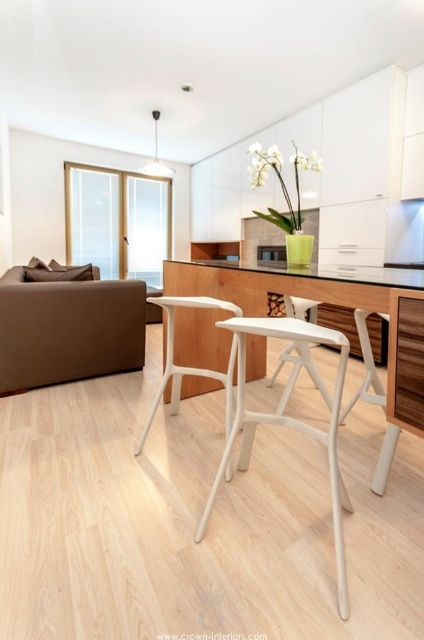
Question: Is white plastic table at center below white plastic bar stool at center?

Choices:
 (A) no
 (B) yes

Answer: (A)

Question: Does brown leather couch at left have a lesser width compared to white plastic bar stool at center?

Choices:
 (A) yes
 (B) no

Answer: (B)

Question: Which of these objects is positioned farthest from the white plastic table at center?

Choices:
 (A) white plastic bar stool at center
 (B) brown leather couch at left

Answer: (B)

Question: Which point is farther from the camera taking this photo?

Choices:
 (A) (178, 289)
 (B) (13, 374)
 (C) (337, 572)

Answer: (B)

Question: Does brown leather couch at left appear under white plastic bar stool at center?

Choices:
 (A) no
 (B) yes

Answer: (A)

Question: Which of these objects is positioned closest to the brown leather couch at left?

Choices:
 (A) white plastic bar stool at center
 (B) white plastic table at center

Answer: (B)